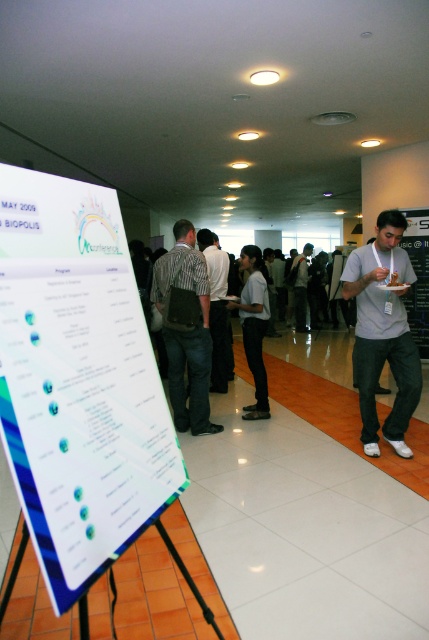
You are standing in the hallway and see the white glossy poster at left and the dark gray shirt at center. Which object is positioned to the left of the other?

The white glossy poster at left is positioned to the left of the dark gray shirt at center.

You are standing in the hallway and want to read the text on the white glossy poster at left. However, a person wearing a dark gray shirt at center is blocking your view. Can you see the poster without moving around the person?

The white glossy poster at left is located below the dark gray shirt at center, so you can still see the poster since it is positioned lower than the person blocking your view.

You are standing in the hallway and want to locate the white glossy poster at left. According to the coordinate system where the bottom left corner of the image is the origin, can you determine its exact location?

The white glossy poster at left is located at coordinate point 0.595 on the x axis and 0.182 on the y axis.